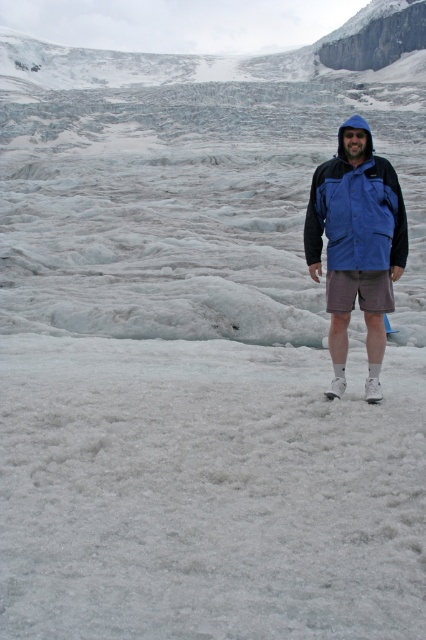
Question: Is blue waterproof jacket at center bigger than gray cotton shorts at center?

Choices:
 (A) no
 (B) yes

Answer: (B)

Question: Among these points, which one is nearest to the camera?

Choices:
 (A) (362, 148)
 (B) (379, 288)

Answer: (B)

Question: Which point is farther to the camera?

Choices:
 (A) blue waterproof jacket at center
 (B) gray cotton shorts at center

Answer: (B)

Question: Which point is farther to the camera?

Choices:
 (A) (333, 241)
 (B) (325, 273)

Answer: (B)

Question: Is blue waterproof jacket at center closer to camera compared to gray cotton shorts at center?

Choices:
 (A) yes
 (B) no

Answer: (A)

Question: Can you confirm if blue waterproof jacket at center is bigger than gray cotton shorts at center?

Choices:
 (A) yes
 (B) no

Answer: (A)